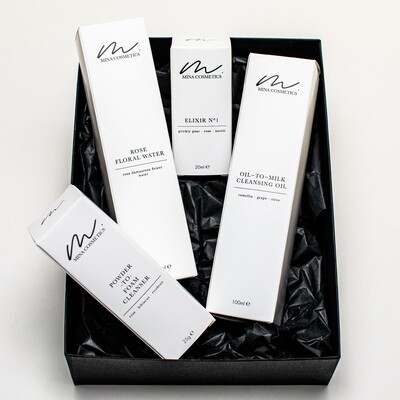
Where is `box`? box is located at coordinates (220, 155).